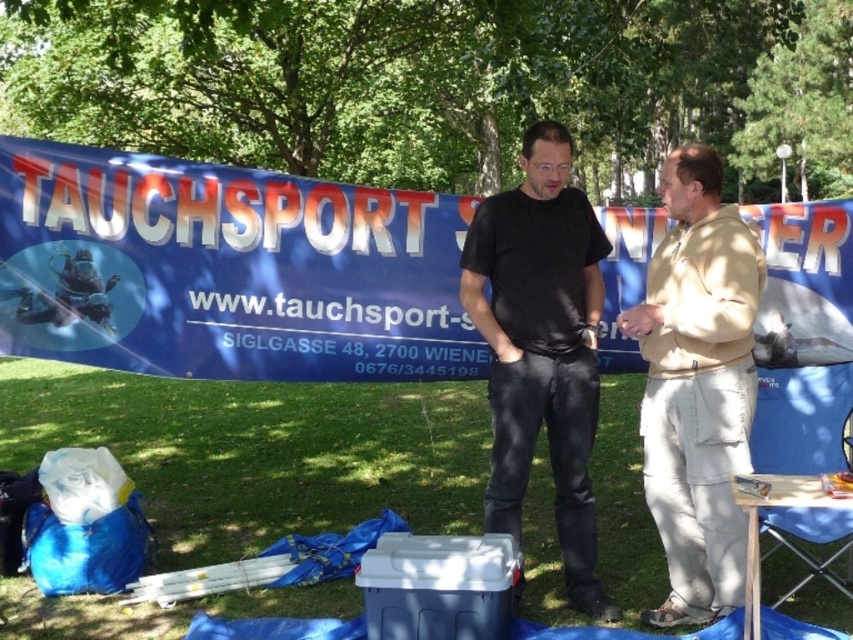
Based on the photo, who is higher up, beige cotton pants at right or black matte shirt at center?

black matte shirt at center

Can you confirm if beige cotton pants at right is positioned to the left of black matte shirt at center?

Incorrect, beige cotton pants at right is not on the left side of black matte shirt at center.

Is point (674, 580) closer to camera compared to point (575, 406)?

Yes, it is in front of point (575, 406).

This screenshot has height=640, width=853. Find the location of `beige cotton pants at right`. beige cotton pants at right is located at coordinates (697, 387).